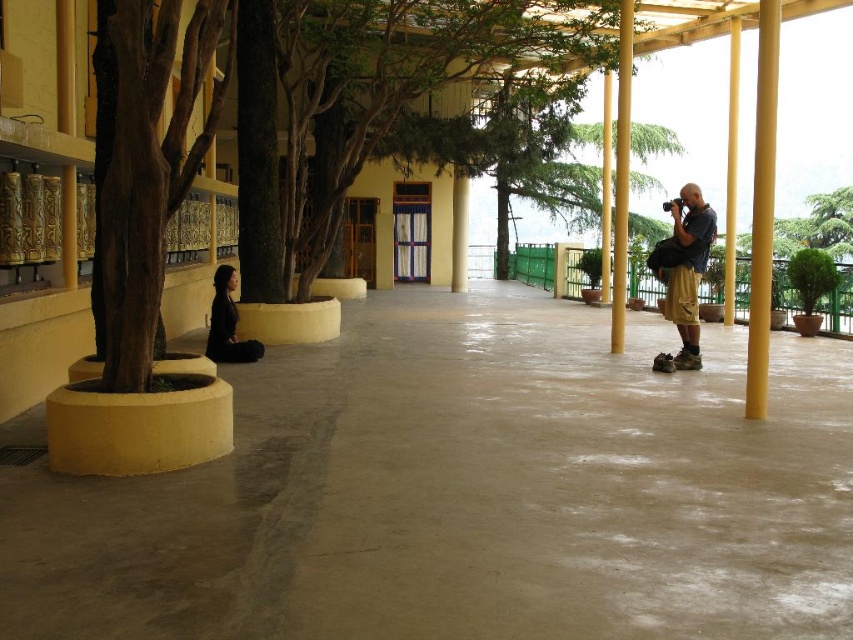
Measure the distance between yellow polished wood pillar at center and camera.

A distance of 32.10 feet exists between yellow polished wood pillar at center and camera.

Does yellow polished wood pillar at center have a lesser width compared to black matte/soft fabric at left?

Correct, yellow polished wood pillar at center's width is less than black matte/soft fabric at left's.

Between point (618, 340) and point (225, 320), which one is positioned in front?

Point (225, 320) is more forward.

Find the location of a particular element. Image resolution: width=853 pixels, height=640 pixels. yellow polished wood pillar at center is located at coordinates (621, 177).

Which of these two, brown rough bark tree at left or yellow matte/porous pillar at right, stands shorter?

Standing shorter between the two is brown rough bark tree at left.

Can you confirm if brown rough bark tree at left is bigger than yellow matte/porous pillar at right?

Indeed, brown rough bark tree at left has a larger size compared to yellow matte/porous pillar at right.

Where is `brown rough bark tree at left`? This screenshot has height=640, width=853. brown rough bark tree at left is located at coordinates (144, 164).

Can you confirm if yellow polished wood pillar at right is bigger than black matte/soft fabric at left?

Correct, yellow polished wood pillar at right is larger in size than black matte/soft fabric at left.

Does point (735, 225) come behind point (225, 353)?

That is True.

Who is more distant from viewer, (735,163) or (234,284)?

The point (735,163) is more distant.

The image size is (853, 640). Find the location of `yellow polished wood pillar at right`. yellow polished wood pillar at right is located at coordinates (730, 172).